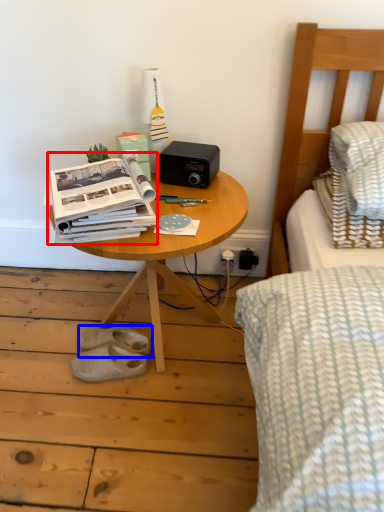
Question: Which object is further to the camera taking this photo, paperback book (highlighted by a red box) or footwear (highlighted by a blue box)?

Choices:
 (A) paperback book
 (B) footwear

Answer: (B)